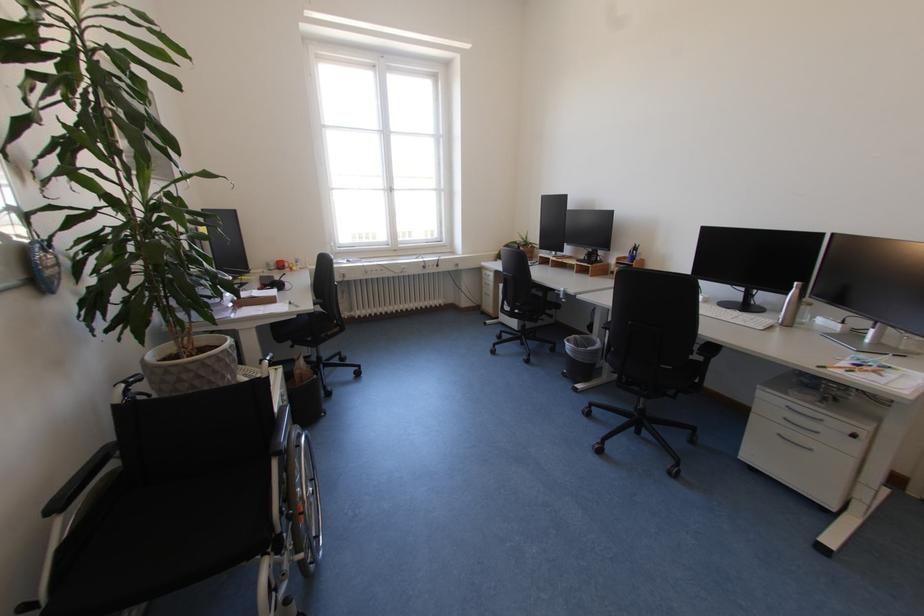
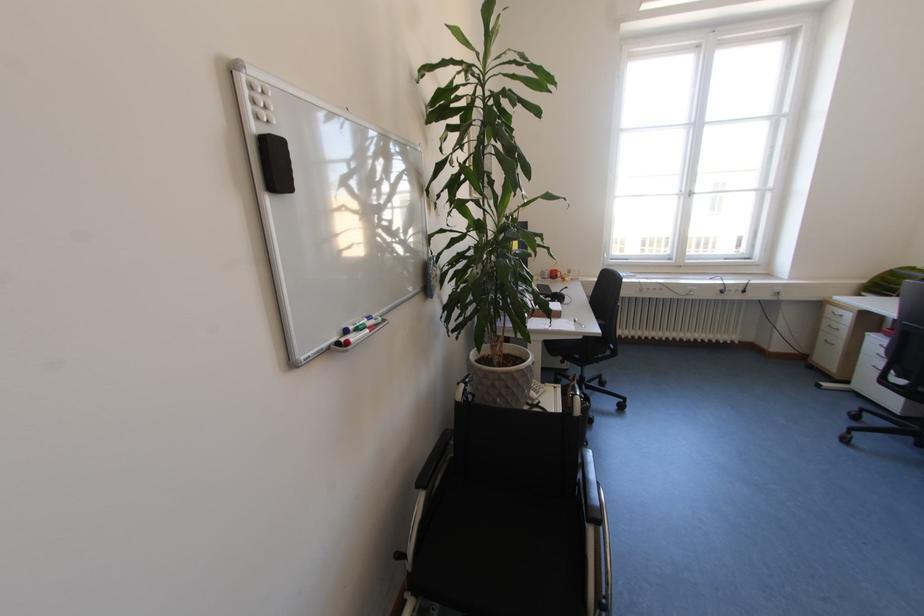
Locate, in the second image, the point that corresponds to pixel 492 286 in the first image.

(833, 328)